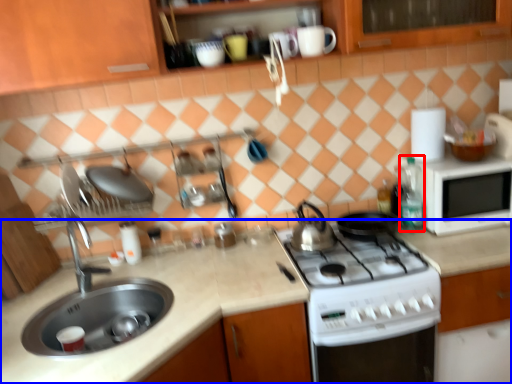
Question: Which point is closer to the camera, bottle (highlighted by a red box) or countertop (highlighted by a blue box)?

Choices:
 (A) bottle
 (B) countertop

Answer: (B)